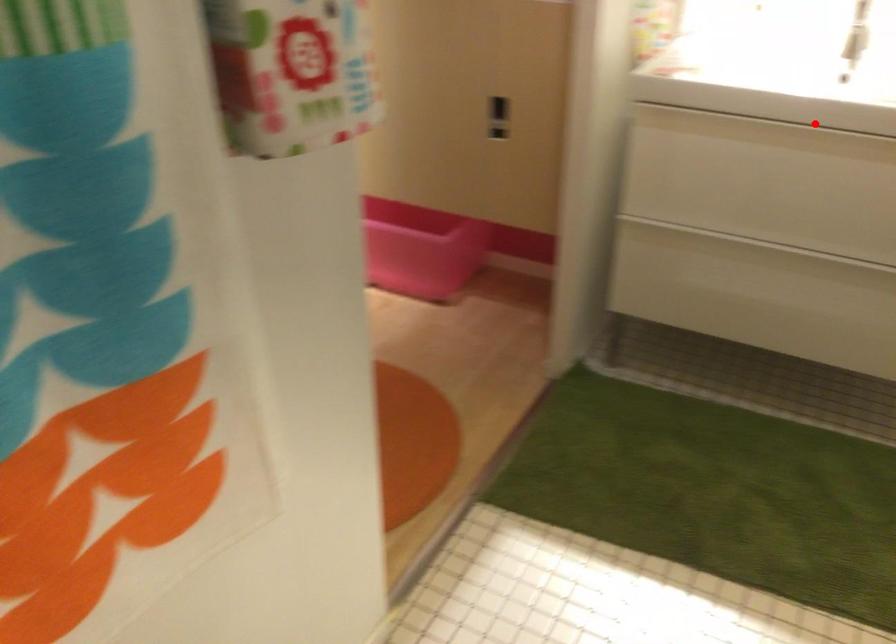
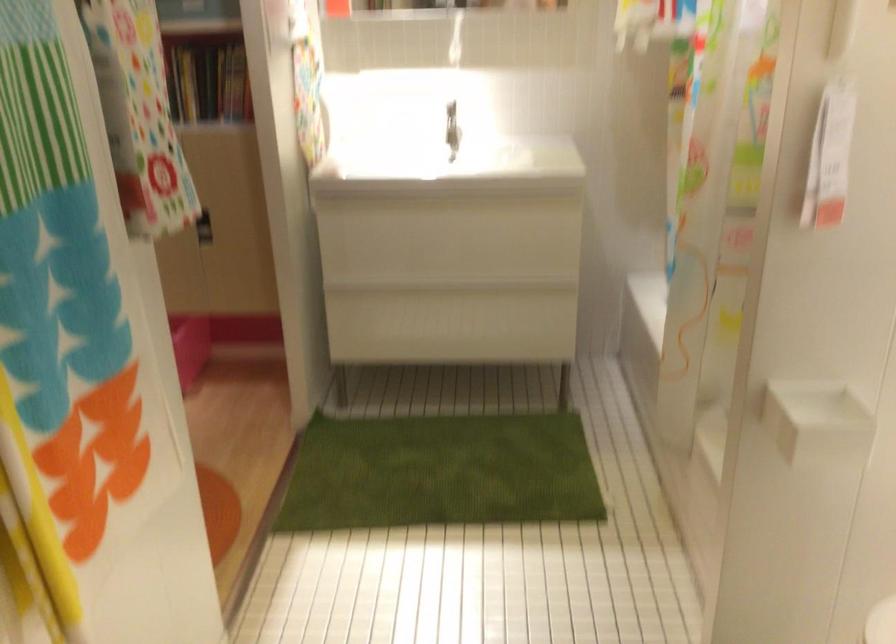
Question: I am providing you with two images of the same scene from different viewpoints. A red point is shown in image1. For the corresponding object point in image2, is it positioned nearer or farther from the camera?

Choices:
 (A) Nearer
 (B) Farther

Answer: (B)